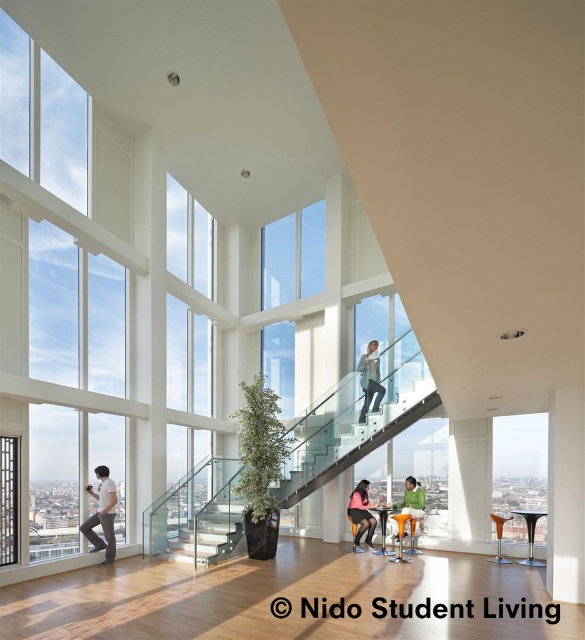
Which of these two, clear glass window at lower left or black glass table at center, stands shorter?

black glass table at center

Can you confirm if clear glass window at lower left is shorter than black glass table at center?

In fact, clear glass window at lower left may be taller than black glass table at center.

Find the location of a particular element. The height and width of the screenshot is (640, 585). clear glass window at lower left is located at coordinates (8, 499).

Can you confirm if transparent glass window at upper right is positioned below white matte shirt at left?

Incorrect, transparent glass window at upper right is not positioned below white matte shirt at left.

Who is higher up, transparent glass window at upper right or white matte shirt at left?

transparent glass window at upper right is higher up.

The width and height of the screenshot is (585, 640). Find the location of `transparent glass window at upper right`. transparent glass window at upper right is located at coordinates (518, 468).

Locate an element on the screen. The height and width of the screenshot is (640, 585). transparent glass window at upper right is located at coordinates (518, 468).

Is transparent glass window at upper right to the right of transparent glass window at upper center from the viewer's perspective?

Correct, you'll find transparent glass window at upper right to the right of transparent glass window at upper center.

Image resolution: width=585 pixels, height=640 pixels. Find the location of `transparent glass window at upper right`. transparent glass window at upper right is located at coordinates (518, 468).

Identify the location of transparent glass window at upper right. Image resolution: width=585 pixels, height=640 pixels. click(518, 468).